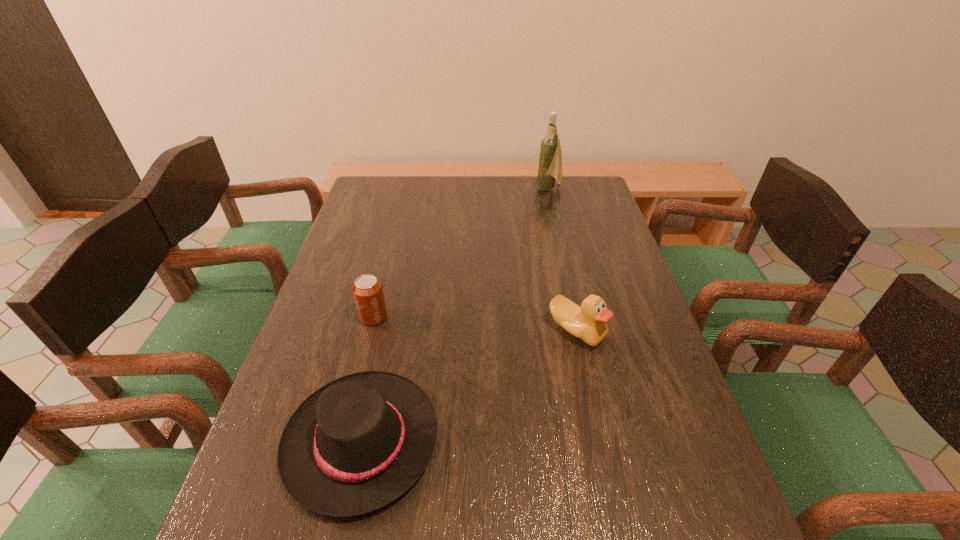
What are the coordinates of `free spot between the wine bottle and the dress hat` in the screenshot? It's located at (455, 315).

You are a GUI agent. You are given a task and a screenshot of the screen. Output one action in this format:
    pyautogui.click(x=<x>, y=<y>)
    Task: Click on the free space that is in between the can and the duck
    The width and height of the screenshot is (960, 540).
    Given the screenshot: What is the action you would take?
    pyautogui.click(x=475, y=323)

Select which object appears as the closest to the nearest object. Please provide its 2D coordinates. Your answer should be formatted as a tuple, i.e. [(x, y)], where the tuple contains the x and y coordinates of a point satisfying the conditions above.

[(367, 290)]

Identify which object is the closest to the farthest object. Please provide its 2D coordinates. Your answer should be formatted as a tuple, i.e. [(x, y)], where the tuple contains the x and y coordinates of a point satisfying the conditions above.

[(588, 322)]

Find the location of a particular element. free spot that satisfies the following two spatial constraints: 1. on the front-facing side of the wine bottle; 2. at the beak of the duck is located at coordinates (582, 330).

I want to click on free space that satisfies the following two spatial constraints: 1. on the front-facing side of the farthest object; 2. at the beak of the duck, so click(x=582, y=330).

Identify the location of vacant space that satisfies the following two spatial constraints: 1. on the front-facing side of the wine bottle; 2. at the beak of the duck. (582, 330).

Where is `vacant space that satisfies the following two spatial constraints: 1. on the front-facing side of the tallest object; 2. at the beak of the duck`? The height and width of the screenshot is (540, 960). vacant space that satisfies the following two spatial constraints: 1. on the front-facing side of the tallest object; 2. at the beak of the duck is located at coordinates (582, 330).